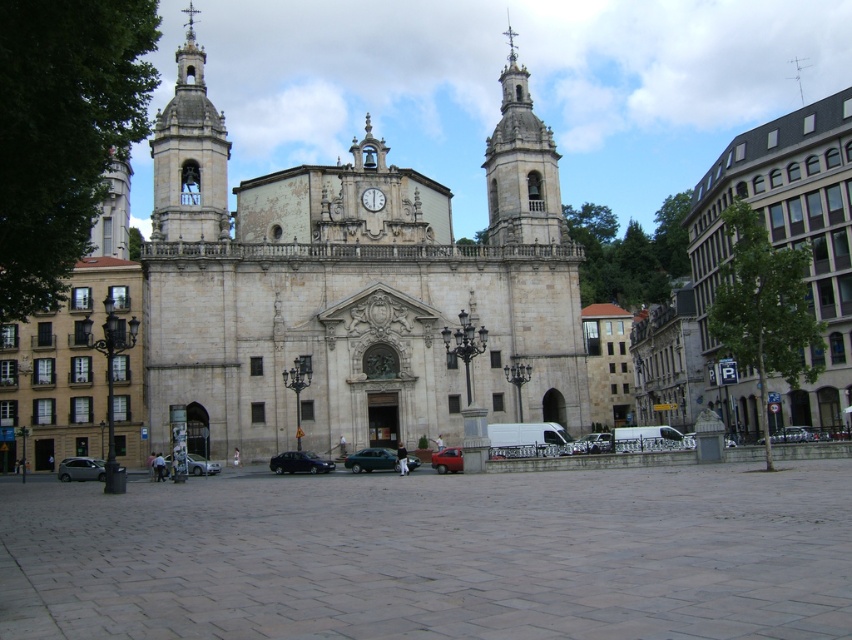
Which is in front, point (72, 460) or point (167, 464)?

Positioned in front is point (167, 464).

Can you confirm if metallic gray car at lower left is positioned to the left of silver metallic car at lower left?

Correct, you'll find metallic gray car at lower left to the left of silver metallic car at lower left.

Is point (96, 476) positioned behind point (197, 472)?

That is True.

Locate an element on the screen. The width and height of the screenshot is (852, 640). metallic gray car at lower left is located at coordinates (79, 468).

Does silver metallic van at center appear on the right side of white stone clock at center?

Yes, silver metallic van at center is to the right of white stone clock at center.

Which is below, silver metallic van at center or white stone clock at center?

silver metallic van at center is below.

Where is `silver metallic van at center`? This screenshot has width=852, height=640. silver metallic van at center is located at coordinates (593, 444).

Identify the location of silver metallic van at center. (593, 444).

Who is more forward, (x=353, y=456) or (x=332, y=468)?

Positioned in front is point (x=353, y=456).

Is metallic green car at center taller than shiny black car at center?

In fact, metallic green car at center may be shorter than shiny black car at center.

You are a GUI agent. You are given a task and a screenshot of the screen. Output one action in this format:
    pyautogui.click(x=<x>, y=<y>)
    Task: Click on the metallic green car at center
    The width and height of the screenshot is (852, 640).
    Given the screenshot: What is the action you would take?
    pyautogui.click(x=371, y=460)

This screenshot has height=640, width=852. What are the coordinates of `metallic green car at center` in the screenshot? It's located at (371, 460).